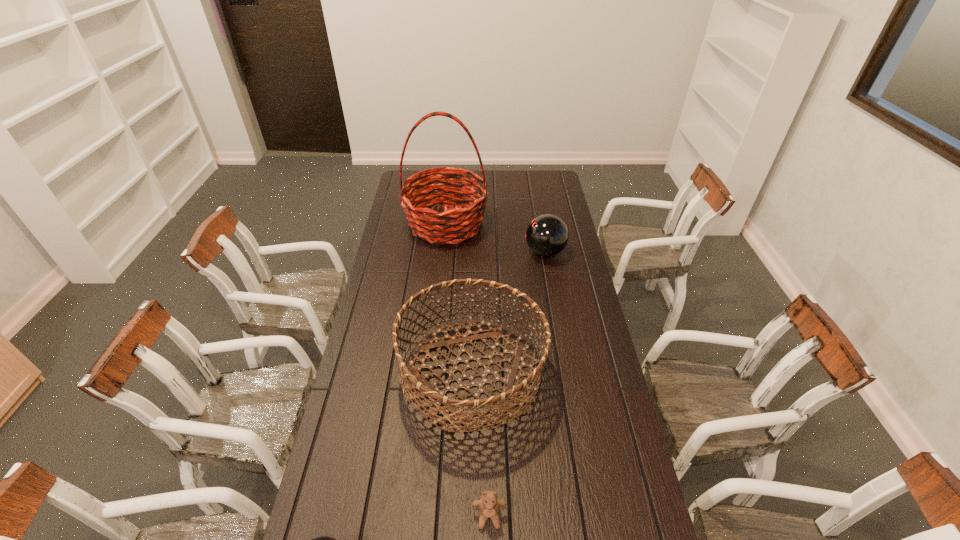
At what (x,y) coordinates should I click in order to perform the action: click on vacant space located on the surface of the taller bowling ball near the finger holes. Please return your answer as a coordinate pair (x, y). Looking at the image, I should click on (507, 252).

Locate an element on the screen. vacant space located 0.250m on the surface of the taller bowling ball near the finger holes is located at coordinates (469, 252).

Identify the location of vacant space located on the surface of the taller bowling ball near the finger holes. (493, 252).

Locate an element on the screen. The image size is (960, 540). object that is at the left edge is located at coordinates (458, 222).

This screenshot has width=960, height=540. What are the coordinates of `object that is at the right edge` in the screenshot? It's located at click(547, 235).

At what (x,y) coordinates should I click in order to perform the action: click on vacant area at the far edge. Please return your answer as a coordinate pair (x, y). The image size is (960, 540). Looking at the image, I should click on (496, 190).

You are a GUI agent. You are given a task and a screenshot of the screen. Output one action in this format:
    pyautogui.click(x=<x>, y=<y>)
    Task: Click on the vacant space at the left edge of the desktop
    This screenshot has height=540, width=960.
    Given the screenshot: What is the action you would take?
    tap(380, 443)

In the image, there is a desktop. What are the coordinates of `vacant space at the right edge` in the screenshot? It's located at (610, 503).

You are a GUI agent. You are given a task and a screenshot of the screen. Output one action in this format:
    pyautogui.click(x=<x>, y=<y>)
    Task: Click on the vacant area at the far left corner
    
    Given the screenshot: What is the action you would take?
    pyautogui.click(x=403, y=180)

What are the coordinates of `free area in between the nearer basket and the taller bowling ball` in the screenshot? It's located at (509, 313).